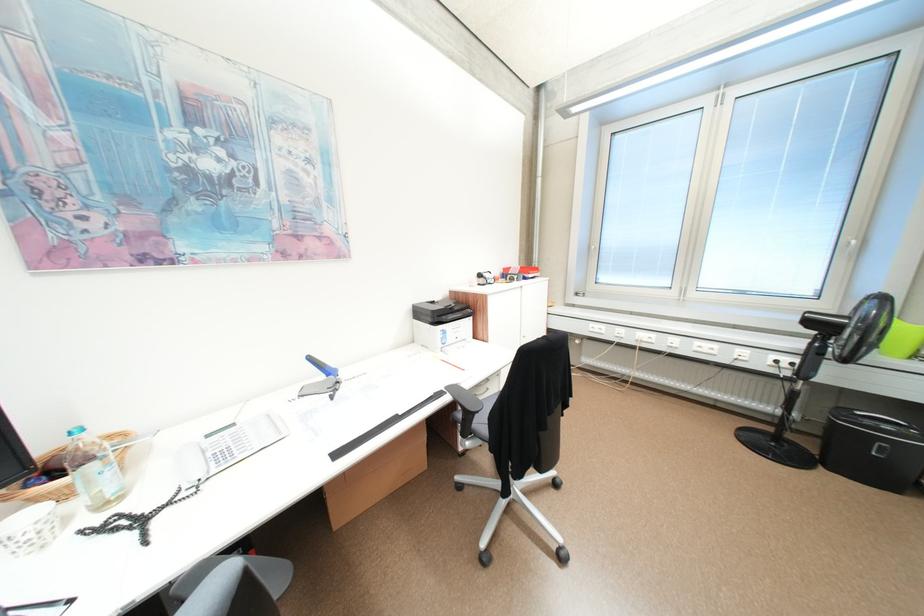
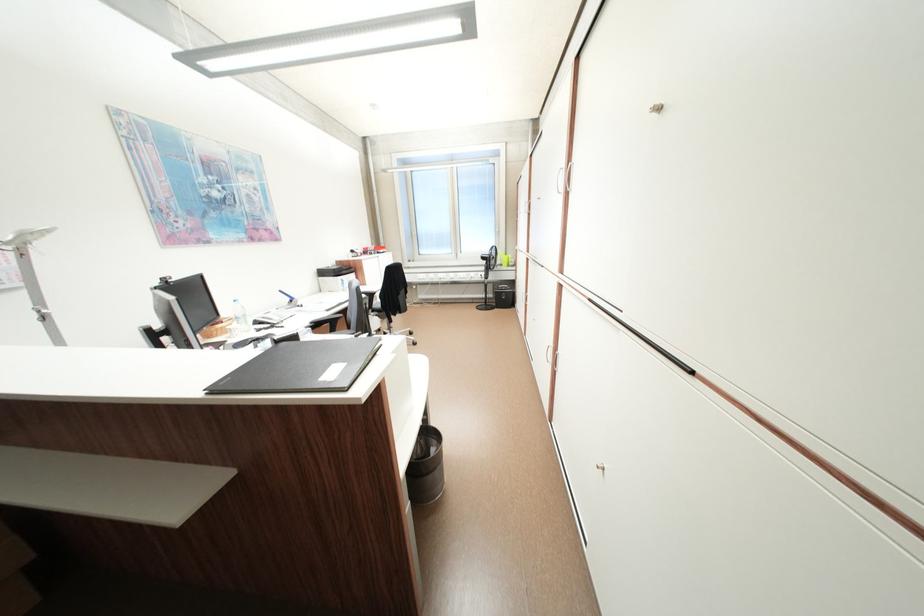
Where in the second image is the point corresponding to [820,323] from the first image?

(492, 259)